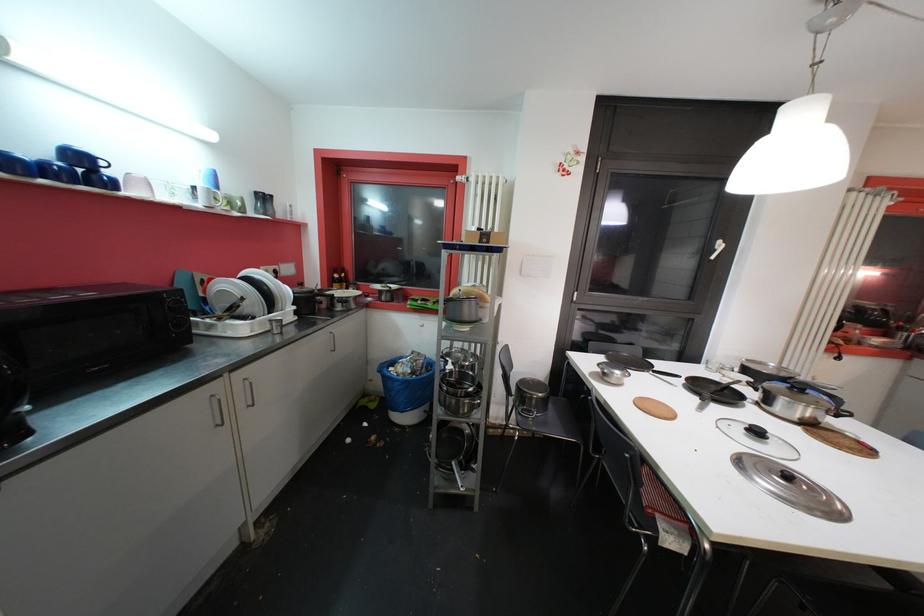
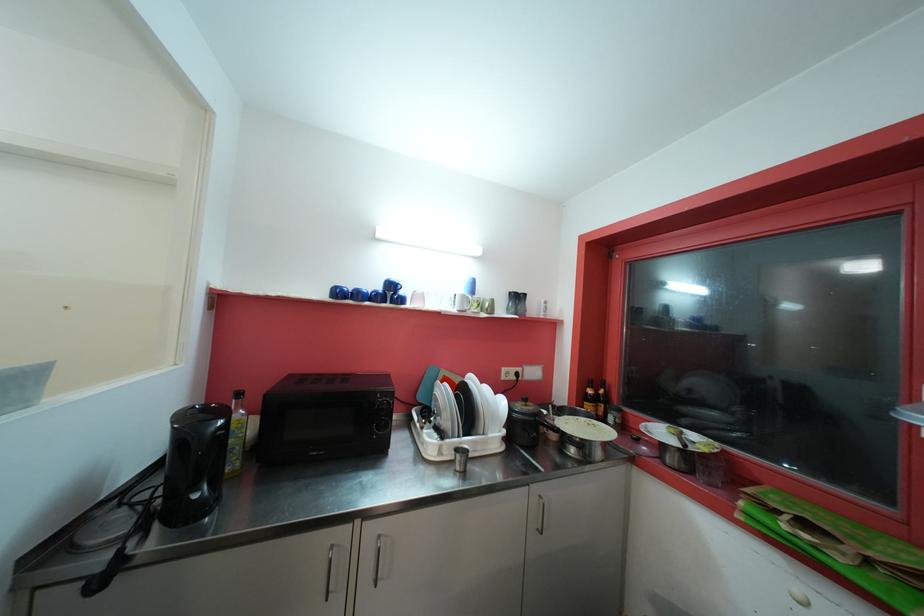
In the second image, find the point that corresponds to [213,192] in the first image.

(468, 299)